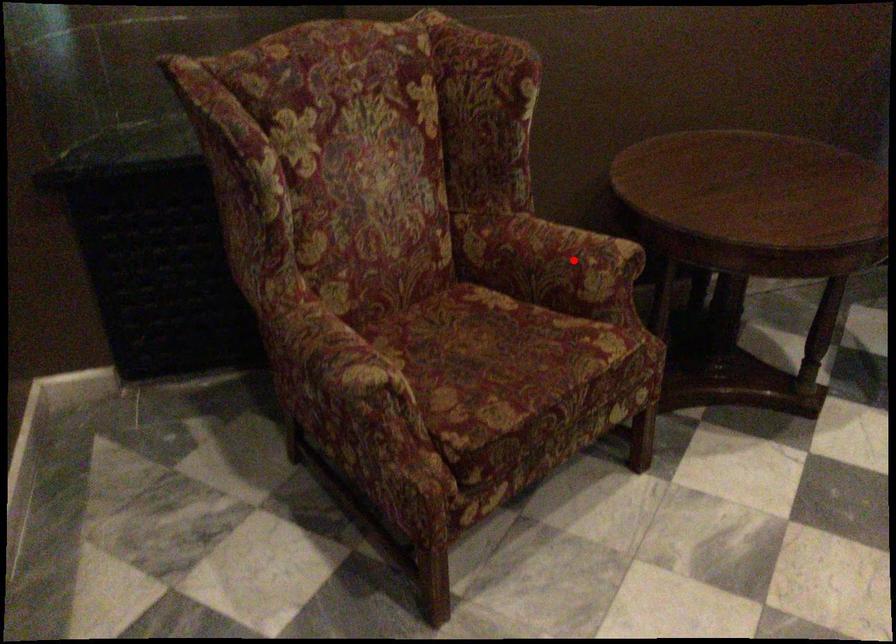
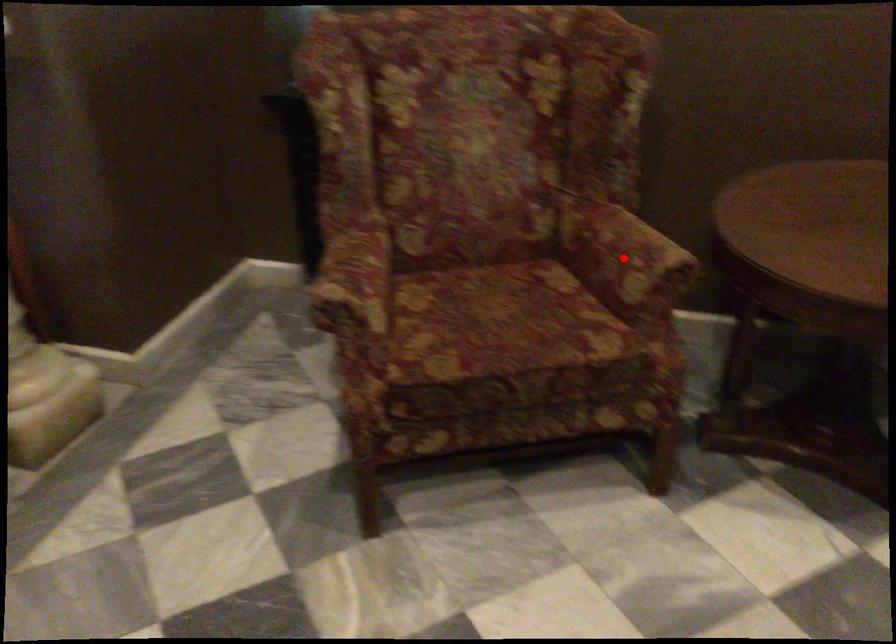
I am providing you with two images of the same scene from different viewpoints. A red point is marked on the first image and another point is marked on the second image. Do the highlighted points in image1 and image2 indicate the same real-world spot?

Yes